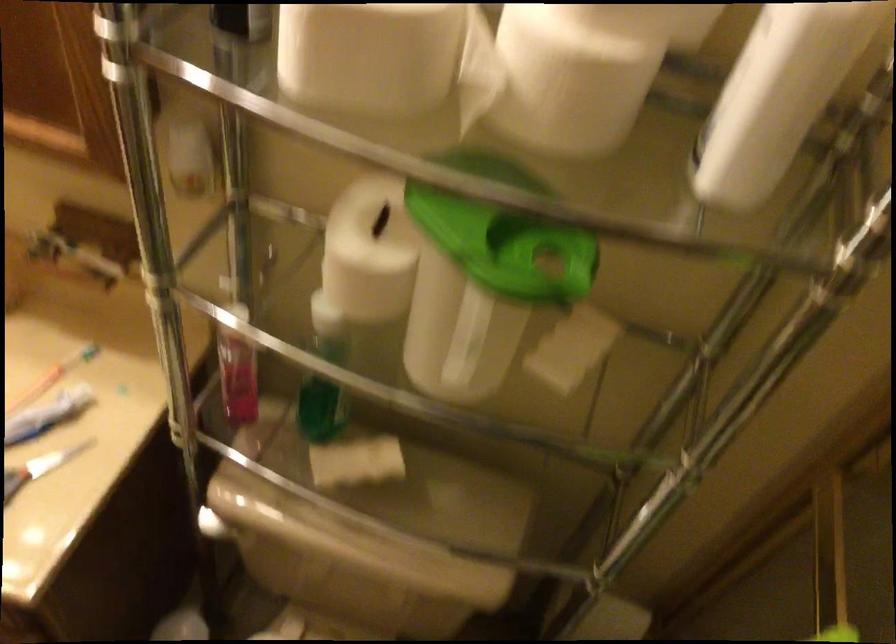
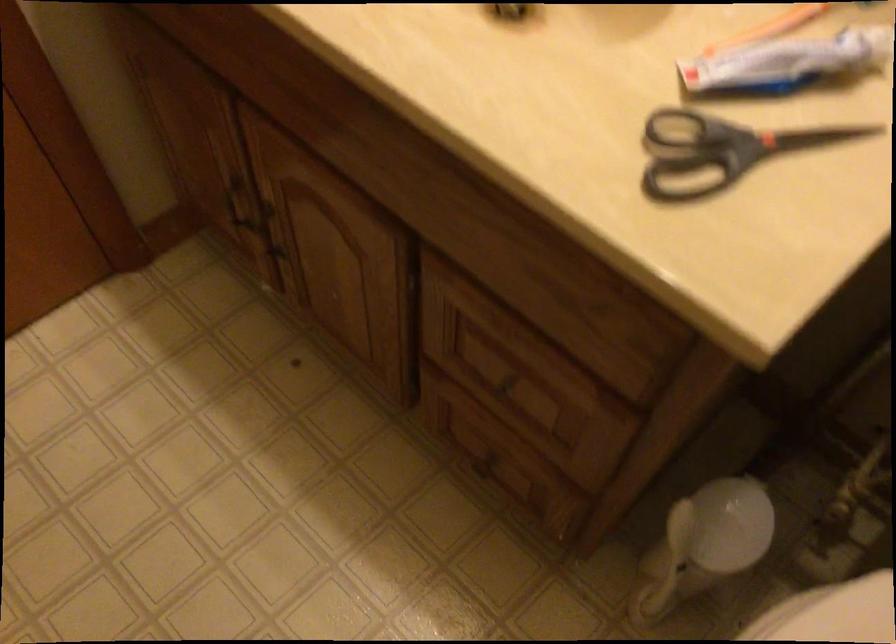
Question: How did the camera likely rotate?

Choices:
 (A) Left
 (B) Right
 (C) Up
 (D) Down

Answer: (A)